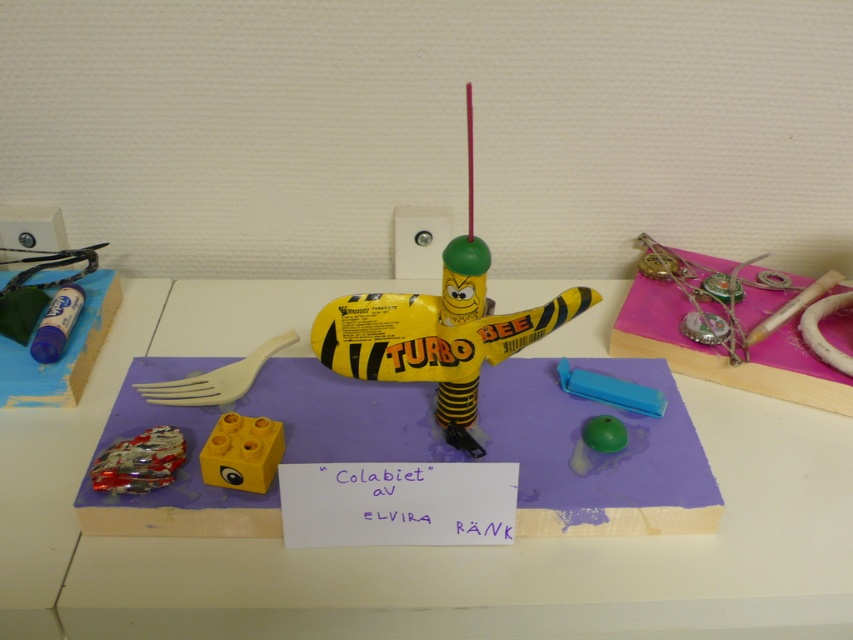
Is purple foam board at center smaller than shiny metallic car at lower left?

No, purple foam board at center is not smaller than shiny metallic car at lower left.

Is point (561, 579) in front of point (161, 456)?

Yes, it is.

Measure the distance between point (824, 444) and camera.

Point (824, 444) and camera are 3.31 feet apart.

In order to click on purple foam board at center in this screenshot , I will do `click(419, 547)`.

Which is below, shiny metallic car at lower left or green rubber ball at center?

Positioned lower is shiny metallic car at lower left.

Is point (155, 468) less distant than point (604, 420)?

That is True.

This screenshot has height=640, width=853. In order to click on shiny metallic car at lower left in this screenshot , I will do `click(138, 461)`.

The image size is (853, 640). I want to click on shiny metallic car at lower left, so click(138, 461).

Which is above, blue plastic eraser at center or matte blue glue stick at left?

Positioned higher is matte blue glue stick at left.

What do you see at coordinates (610, 388) in the screenshot? I see `blue plastic eraser at center` at bounding box center [610, 388].

Does point (636, 400) come closer to viewer compared to point (57, 340)?

That is True.

Find the location of a particular element. The height and width of the screenshot is (640, 853). blue plastic eraser at center is located at coordinates (610, 388).